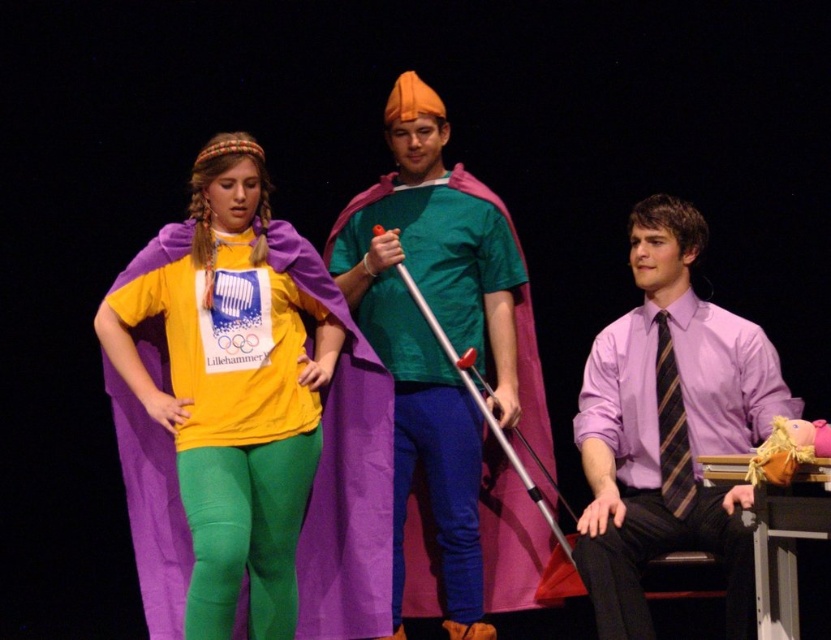
Question: Does matte green t-shirt at center have a greater width compared to purple silk shirt at right?

Choices:
 (A) yes
 (B) no

Answer: (A)

Question: Does matte yellow t-shirt at center have a smaller size compared to matte green t-shirt at center?

Choices:
 (A) no
 (B) yes

Answer: (B)

Question: Which is farther from the striped silk tie at right?

Choices:
 (A) matte yellow t-shirt at center
 (B) purple silk shirt at right

Answer: (A)

Question: Is matte yellow t-shirt at center bigger than purple silk shirt at right?

Choices:
 (A) no
 (B) yes

Answer: (A)

Question: Estimate the real-world distances between objects in this image. Which object is farther from the matte green t-shirt at center?

Choices:
 (A) purple silk shirt at right
 (B) striped silk tie at right
 (C) matte yellow t-shirt at center

Answer: (B)

Question: Based on their relative distances, which object is nearer to the matte green t-shirt at center?

Choices:
 (A) purple silk shirt at right
 (B) striped silk tie at right
 (C) matte yellow t-shirt at center

Answer: (C)